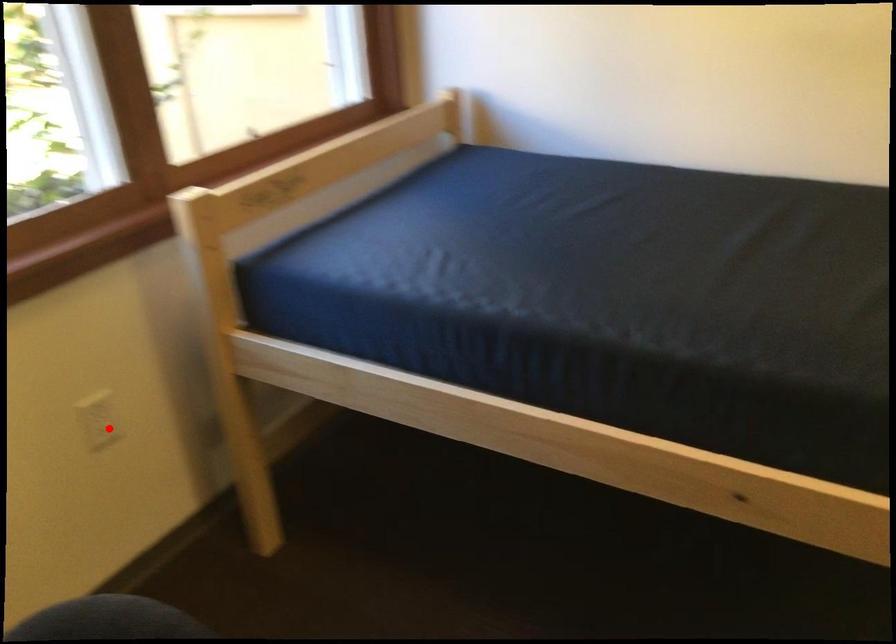
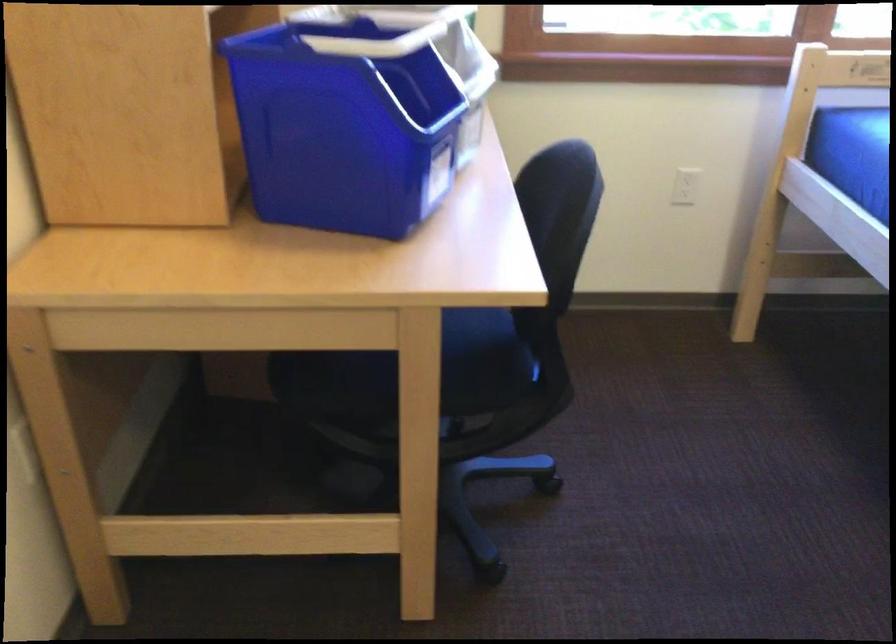
Question: A red point is marked in image1. In image2, is the corresponding 3D point closer to the camera or farther? Reply with the corresponding letter.

Choices:
 (A) The corresponding 3D point is closer.
 (B) The corresponding 3D point is farther.

Answer: (B)